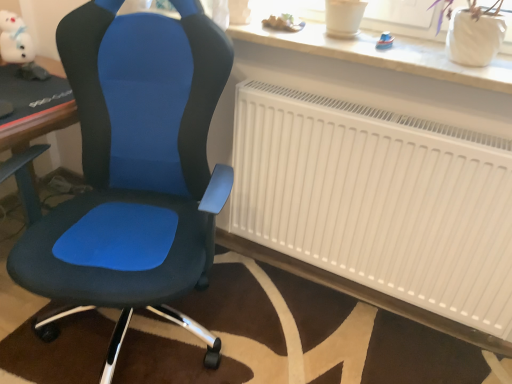
What do you see at coordinates (385, 41) in the screenshot? The width and height of the screenshot is (512, 384). I see `blue plastic toy at upper right, which ranks as the first toy in front-to-back order` at bounding box center [385, 41].

You are a GUI agent. You are given a task and a screenshot of the screen. Output one action in this format:
    pyautogui.click(x=<x>, y=<y>)
    Task: Click on the blue plastic toy at upper right, which appears as the 3th toy when viewed from the back
    The image size is (512, 384).
    Given the screenshot: What is the action you would take?
    pyautogui.click(x=385, y=41)

Considering their positions, is matte blue fabric chair at center located in front of or behind white matte radiator at center?

matte blue fabric chair at center is in front of white matte radiator at center.

Is matte blue fabric chair at center placed right next to white matte radiator at center?

matte blue fabric chair at center and white matte radiator at center are clearly separated.

Can you confirm if matte blue fabric chair at center is thinner than white matte radiator at center?

Incorrect, the width of matte blue fabric chair at center is not less than that of white matte radiator at center.

Does matte blue fabric chair at center come in front of wooden toy boat at upper center, which ranks as the second toy in front-to-back order?

Yes, it is.

Are matte blue fabric chair at center and wooden toy boat at upper center, the second toy positioned from the left, making contact?

They are not placed beside each other.

Is matte blue fabric chair at center positioned with its back to wooden toy boat at upper center, the second toy positioned from the left?

matte blue fabric chair at center is not turned away from wooden toy boat at upper center, the second toy positioned from the left.

Consider the image. From a real-world perspective, does matte blue fabric chair at center stand above wooden toy boat at upper center, placed as the second toy when sorted from right to left?

No, from a real-world perspective, matte blue fabric chair at center is not over wooden toy boat at upper center, placed as the second toy when sorted from right to left

Is blue plastic toy at upper right, which appears as the 3th toy when viewed from the back, in front of or behind white matte radiator at center in the image?

blue plastic toy at upper right, which appears as the 3th toy when viewed from the back, is behind white matte radiator at center.

Based on their sizes in the image, would you say blue plastic toy at upper right, which ranks as the first toy in front-to-back order, is bigger or smaller than white matte radiator at center?

Considering their sizes, blue plastic toy at upper right, which ranks as the first toy in front-to-back order, takes up less space than white matte radiator at center.

From a real-world perspective, who is located lower, blue plastic toy at upper right, which ranks as the first toy in front-to-back order, or white matte radiator at center?

white matte radiator at center is physically lower.

Is blue plastic toy at upper right, arranged as the 1th toy when viewed from the right, positioned far away from white matte radiator at center?

That's not correct — blue plastic toy at upper right, arranged as the 1th toy when viewed from the right, is a little close to white matte radiator at center.

Does wooden toy boat at upper center, which ranks as the second toy in front-to-back order, appear on the left side of white plush toy at upper left, the first toy positioned from the back?

No, wooden toy boat at upper center, which ranks as the second toy in front-to-back order, is not to the left of white plush toy at upper left, the first toy positioned from the back.

From the picture: Who is more distant, wooden toy boat at upper center, which ranks as the second toy in back-to-front order, or white plush toy at upper left, the first toy positioned from the left?

white plush toy at upper left, the first toy positioned from the left, is further away from the camera.

From the image's perspective, is wooden toy boat at upper center, the second toy positioned from the left, positioned above or below white plush toy at upper left, arranged as the 3th toy when viewed from the front?

Clearly, from the image's perspective, wooden toy boat at upper center, the second toy positioned from the left, is below white plush toy at upper left, arranged as the 3th toy when viewed from the front.

Between wooden toy boat at upper center, placed as the second toy when sorted from right to left, and white plush toy at upper left, the first toy positioned from the left, which one has larger size?

Bigger between the two is white plush toy at upper left, the first toy positioned from the left.

Does wooden toy boat at upper center, which ranks as the second toy in front-to-back order, have a greater height compared to white matte radiator at center?

In fact, wooden toy boat at upper center, which ranks as the second toy in front-to-back order, may be shorter than white matte radiator at center.

Is wooden toy boat at upper center, which ranks as the second toy in front-to-back order, not within white matte radiator at center?

Yes.

Consider the image. What's the angular difference between wooden toy boat at upper center, the second toy positioned from the left, and white matte radiator at center's facing directions?

2.34 degrees separate the facing orientations of wooden toy boat at upper center, the second toy positioned from the left, and white matte radiator at center.

Does point (342, 184) appear closer or farther from the camera than point (280, 20)?

Point (342, 184) is positioned farther from the camera compared to point (280, 20).

In the scene shown: From a real-world perspective, relative to wooden toy boat at upper center, the second toy positioned from the left, is white matte radiator at center vertically above or below?

In terms of real-world spatial position, white matte radiator at center is below wooden toy boat at upper center, the second toy positioned from the left.

Between white matte radiator at center and wooden toy boat at upper center, the second toy positioned from the left, which one appears on the right side from the viewer's perspective?

white matte radiator at center.

Is white matte radiator at center positioned in front of wooden toy boat at upper center, the second toy positioned from the left?

Yes.

Is blue plastic toy at upper right, arranged as the 1th toy when viewed from the right, surrounding matte blue fabric chair at center?

No, blue plastic toy at upper right, arranged as the 1th toy when viewed from the right, does not contain matte blue fabric chair at center.

Who is bigger, blue plastic toy at upper right, arranged as the 1th toy when viewed from the right, or matte blue fabric chair at center?

With larger size is matte blue fabric chair at center.

At what (x,y) coordinates should I click in order to perform the action: click on chair below the blue plastic toy at upper right, acting as the 3th toy starting from the left (from the image's perspective). Please return your answer as a coordinate pair (x, y). Image resolution: width=512 pixels, height=384 pixels. Looking at the image, I should click on (134, 171).

What's the angular difference between blue plastic toy at upper right, acting as the 3th toy starting from the left, and matte blue fabric chair at center's facing directions?

The facing directions of blue plastic toy at upper right, acting as the 3th toy starting from the left, and matte blue fabric chair at center are 21 degrees apart.

Locate an element on the screen. This screenshot has width=512, height=384. chair in front of the white matte radiator at center is located at coordinates pyautogui.click(x=134, y=171).

From the matte blue fabric chair at center, count 1st toy to the right and point to it. Please provide its 2D coordinates.

[(283, 23)]

Considering their positions, is matte blue fabric chair at center positioned further to white matte radiator at center than blue plastic toy at upper right, which appears as the 3th toy when viewed from the back?

blue plastic toy at upper right, which appears as the 3th toy when viewed from the back, is positioned further to the anchor white matte radiator at center.

Considering their positions, is white plush toy at upper left, the first toy positioned from the left, positioned closer to white matte radiator at center than blue plastic toy at upper right, which ranks as the first toy in front-to-back order?

blue plastic toy at upper right, which ranks as the first toy in front-to-back order, lies closer to white matte radiator at center than the other object.

Based on their spatial positions, is white matte radiator at center or matte blue fabric chair at center closer to wooden toy boat at upper center, which ranks as the second toy in front-to-back order?

matte blue fabric chair at center lies closer to wooden toy boat at upper center, which ranks as the second toy in front-to-back order, than the other object.

Based on their spatial positions, is blue plastic toy at upper right, arranged as the 1th toy when viewed from the right, or wooden toy boat at upper center, placed as the second toy when sorted from right to left, closer to white matte radiator at center?

blue plastic toy at upper right, arranged as the 1th toy when viewed from the right, lies closer to white matte radiator at center than the other object.

Which object lies nearer to the anchor point matte blue fabric chair at center, wooden toy boat at upper center, placed as the second toy when sorted from right to left, or white matte radiator at center?

white matte radiator at center is closer to matte blue fabric chair at center.

Looking at the image, which one is located further to white plush toy at upper left, the third toy positioned from the right, wooden toy boat at upper center, which ranks as the second toy in front-to-back order, or matte blue fabric chair at center?

wooden toy boat at upper center, which ranks as the second toy in front-to-back order, is further to white plush toy at upper left, the third toy positioned from the right.

Looking at the image, which one is located further to blue plastic toy at upper right, arranged as the 1th toy when viewed from the right, matte blue fabric chair at center or white matte radiator at center?

matte blue fabric chair at center is positioned further to the anchor blue plastic toy at upper right, arranged as the 1th toy when viewed from the right.

Estimate the real-world distances between objects in this image. Which object is closer to white matte radiator at center, wooden toy boat at upper center, the second toy positioned from the left, or matte blue fabric chair at center?

matte blue fabric chair at center.

Where is `chair between white plush toy at upper left, the first toy positioned from the back, and wooden toy boat at upper center, placed as the second toy when sorted from right to left, from left to right`? The width and height of the screenshot is (512, 384). chair between white plush toy at upper left, the first toy positioned from the back, and wooden toy boat at upper center, placed as the second toy when sorted from right to left, from left to right is located at coordinates [134, 171].

Locate an element on the screen. This screenshot has width=512, height=384. toy located between white plush toy at upper left, arranged as the 3th toy when viewed from the front, and blue plastic toy at upper right, which ranks as the first toy in front-to-back order, in the left-right direction is located at coordinates (283, 23).

Locate an element on the screen. This screenshot has width=512, height=384. chair between white plush toy at upper left, the third toy positioned from the right, and white matte radiator at center is located at coordinates (134, 171).

At what (x,y) coordinates should I click in order to perform the action: click on toy between wooden toy boat at upper center, placed as the second toy when sorted from right to left, and white matte radiator at center from top to bottom. Please return your answer as a coordinate pair (x, y). The image size is (512, 384). Looking at the image, I should click on (385, 41).